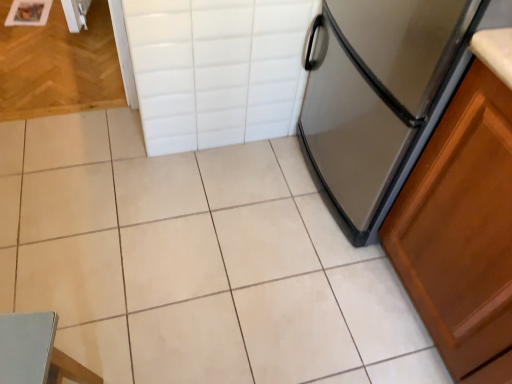
Identify the location of vacant region to the left of white tile drawer at upper center. (125, 155).